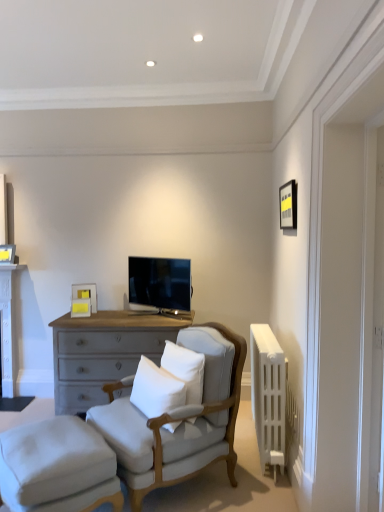
Question: Is point (105, 422) positioned closer to the camera than point (264, 366)?

Choices:
 (A) closer
 (B) farther

Answer: (A)

Question: Would you say light gray fabric chair at center is to the left or to the right of white plastic radiator at right in the picture?

Choices:
 (A) right
 (B) left

Answer: (B)

Question: Which is nearer to the white soft cushion at center, arranged as the second pillow when viewed from the left?

Choices:
 (A) white soft cushion at center, the 2th pillow in the right-to-left sequence
 (B) white plastic radiator at right
 (C) white painted wood table at left
 (D) light gray fabric chair at center
 (E) matte black tv at center

Answer: (A)

Question: Estimate the real-world distances between objects in this image. Which object is farther from the light gray fabric chair at center?

Choices:
 (A) white soft cushion at center, which is the first pillow from left to right
 (B) white plastic radiator at right
 (C) white painted wood table at left
 (D) white soft cushion at center, marked as the first pillow in a right-to-left arrangement
 (E) white fabric stool at lower left

Answer: (C)